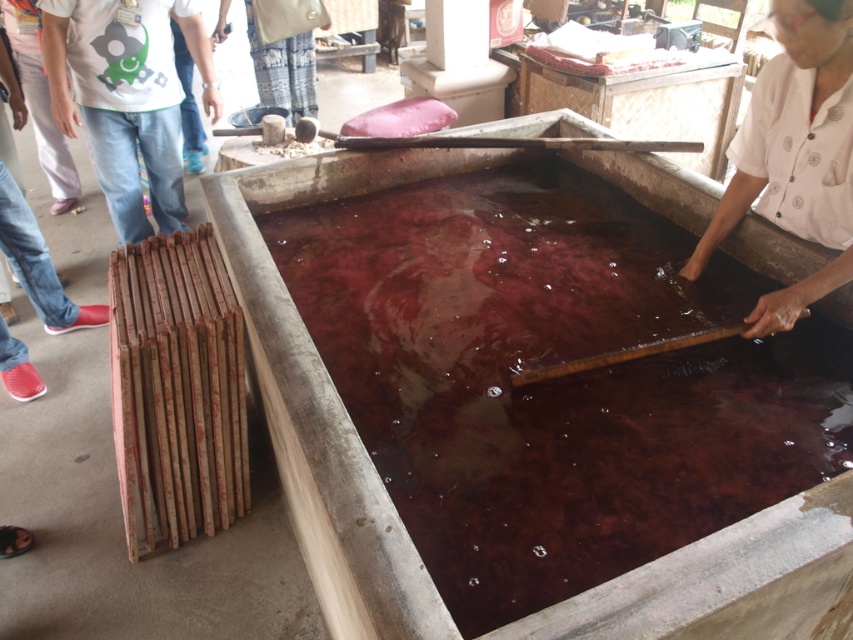
You are an observer standing in front of the basin. You see the brown translucent water at center and the white dotted shirt at upper right. Which object is positioned lower in the scene?

The brown translucent water at center is below the white dotted shirt at upper right, so the brown translucent water at center is lower in the scene.

You are an observer standing in front of the basin. Can you see the white cotton shirt at upper left through the brown translucent water at center?

Yes, since the brown translucent water at center is positioned under the white cotton shirt at upper left, the shirt is above the water and can be seen through the translucent water.